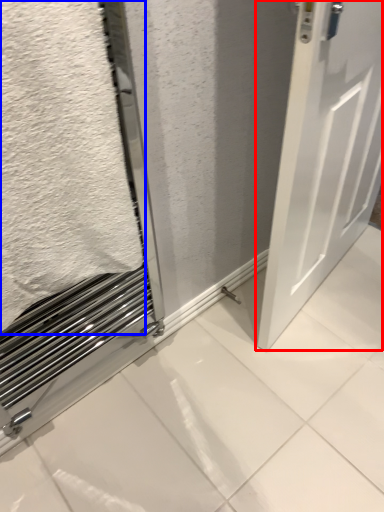
Question: Among these objects, which one is farthest to the camera, door (highlighted by a red box) or bath towel (highlighted by a blue box)?

Choices:
 (A) door
 (B) bath towel

Answer: (A)